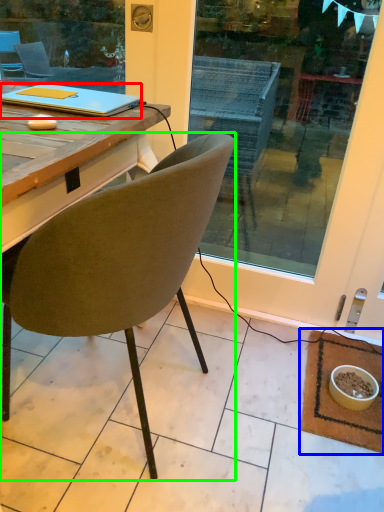
Question: Based on their relative distances, which object is nearer to laptop (highlighted by a red box)? Choose from mat (highlighted by a blue box) and chair (highlighted by a green box).

Choices:
 (A) mat
 (B) chair

Answer: (B)